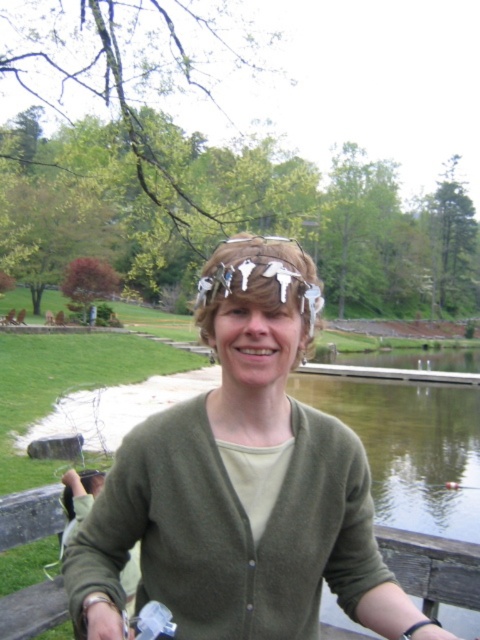
Question: Does matte green cardigan at center lie in front of brown matte hair at center?

Choices:
 (A) yes
 (B) no

Answer: (A)

Question: Is matte green cardigan at center below brown matte hair at center?

Choices:
 (A) no
 (B) yes

Answer: (B)

Question: Does matte green cardigan at center have a smaller size compared to brown matte hair at center?

Choices:
 (A) yes
 (B) no

Answer: (A)